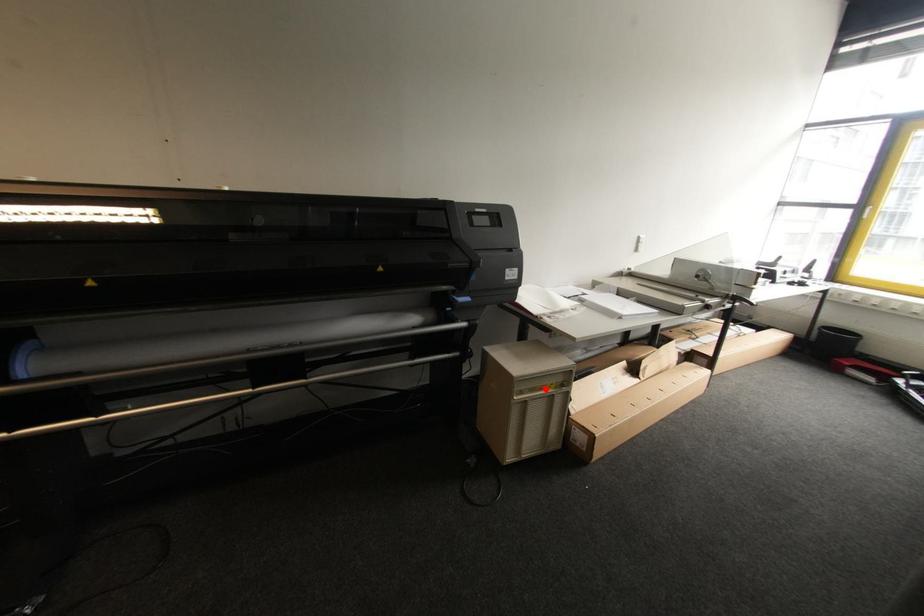
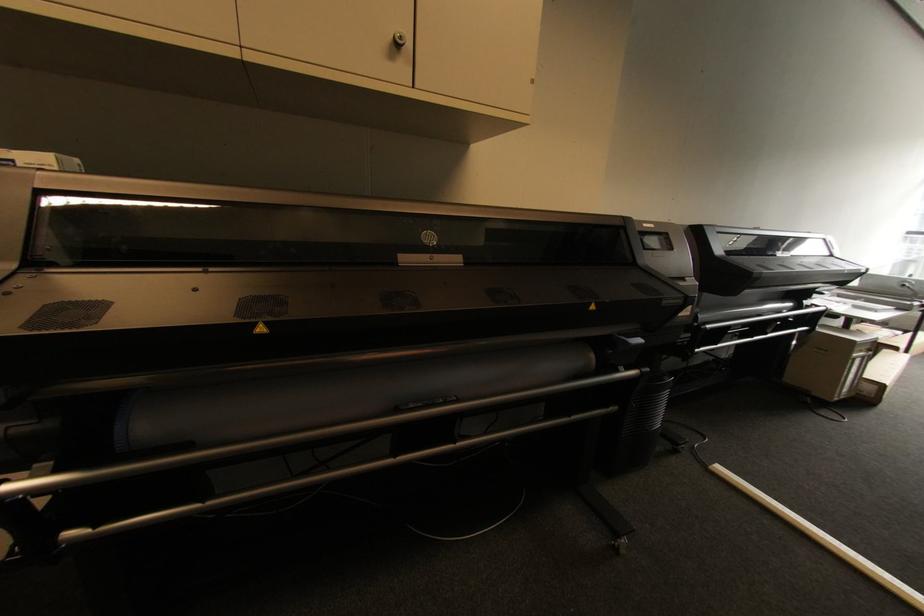
Where in the second image is the point corresponding to the highlighted location from the first image?

(867, 352)